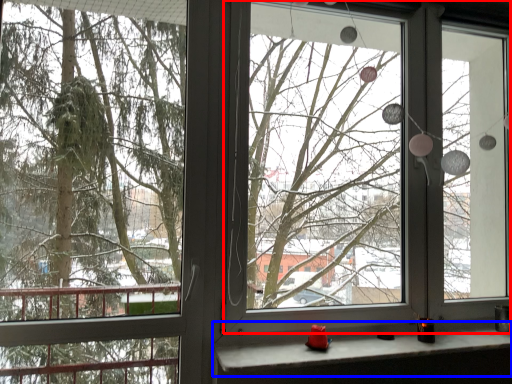
Question: Which of the following is the closest to the observer, window screen (highlighted by a red box) or window sill (highlighted by a blue box)?

Choices:
 (A) window screen
 (B) window sill

Answer: (B)